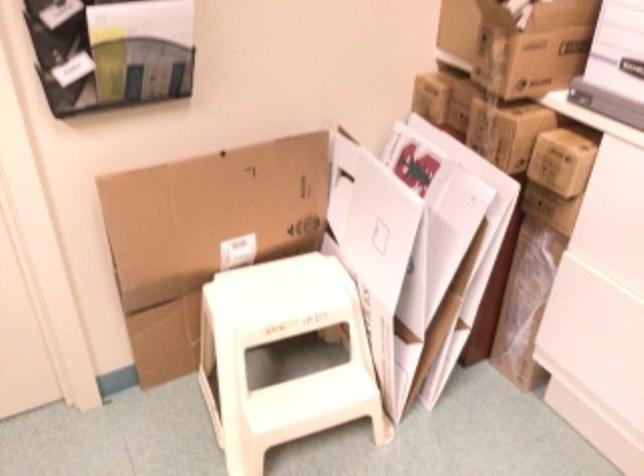
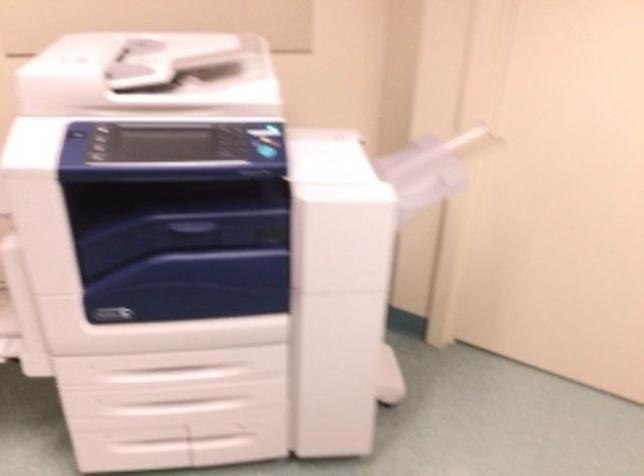
Question: How did the camera likely rotate?

Choices:
 (A) Left
 (B) Right
 (C) Up
 (D) Down

Answer: (A)